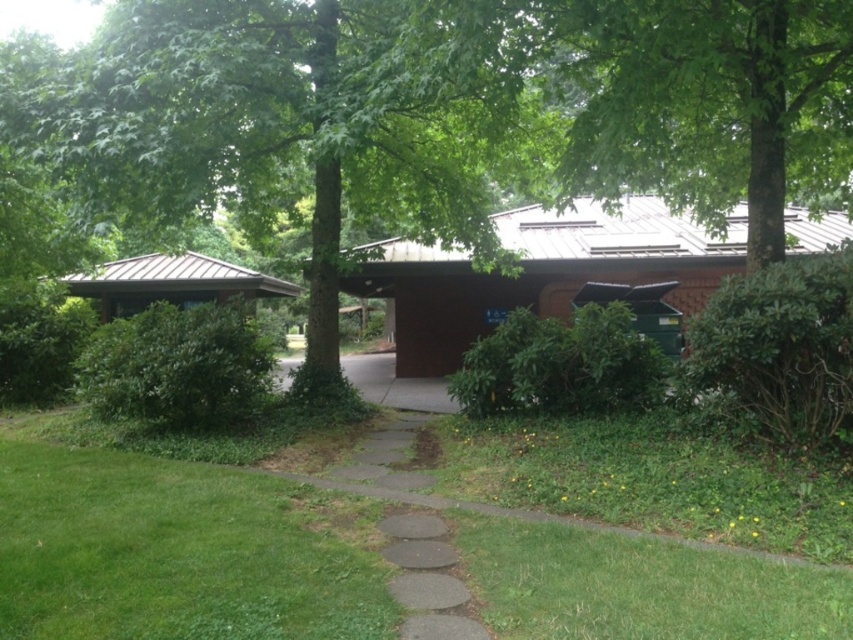
Question: Among these points, which one is farthest from the camera?

Choices:
 (A) (24, 465)
 (B) (422, 1)
 (C) (415, 394)
 (D) (604, 58)

Answer: (C)

Question: Estimate the real-world distances between objects in this image. Which object is closer to the brown concrete driveway at center?

Choices:
 (A) green grass at lower left
 (B) green leafy tree at center
 (C) green leafy tree at upper center

Answer: (B)

Question: Is green grass at lower left below brown concrete driveway at center?

Choices:
 (A) yes
 (B) no

Answer: (A)

Question: Which object appears closest to the camera in this image?

Choices:
 (A) green leafy tree at upper center
 (B) green leafy tree at center

Answer: (A)

Question: Can you confirm if green grass at lower left is thinner than green leafy tree at upper center?

Choices:
 (A) yes
 (B) no

Answer: (B)

Question: Is green leafy tree at center above brown concrete driveway at center?

Choices:
 (A) yes
 (B) no

Answer: (A)